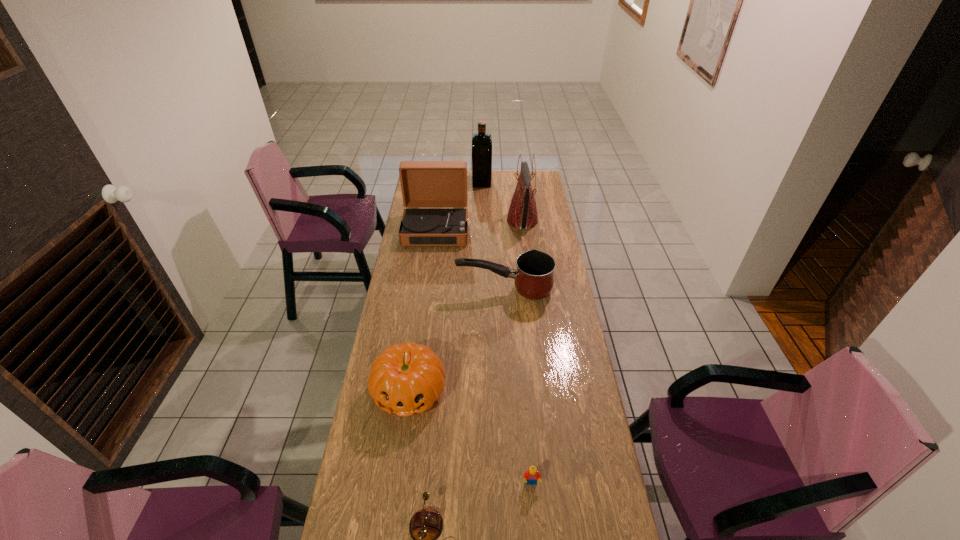
You are a GUI agent. You are given a task and a screenshot of the screen. Output one action in this format:
    pyautogui.click(x=<x>, y=<y>)
    Task: Click on the vacant space that is in between the Lego and the liquor
    
    Given the screenshot: What is the action you would take?
    pyautogui.click(x=507, y=332)

Locate an element on the screen. object that is the fourth closest to the pumpkin is located at coordinates (434, 193).

In order to click on the fourth closest object to the fifth farthest object in this screenshot , I will do `click(434, 193)`.

What are the coordinates of `free spot that satisfies the following two spatial constraints: 1. on the front label of the farthest object; 2. on the carved face of the third nearest object` in the screenshot? It's located at (483, 390).